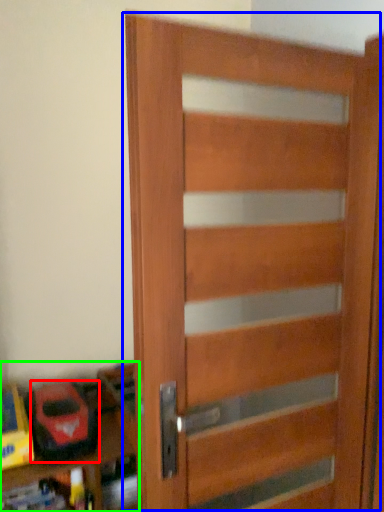
Question: Considering the real-world distances, which object is farthest from toy (highlighted by a red box)? door (highlighted by a blue box) or shelf (highlighted by a green box)?

Choices:
 (A) door
 (B) shelf

Answer: (A)